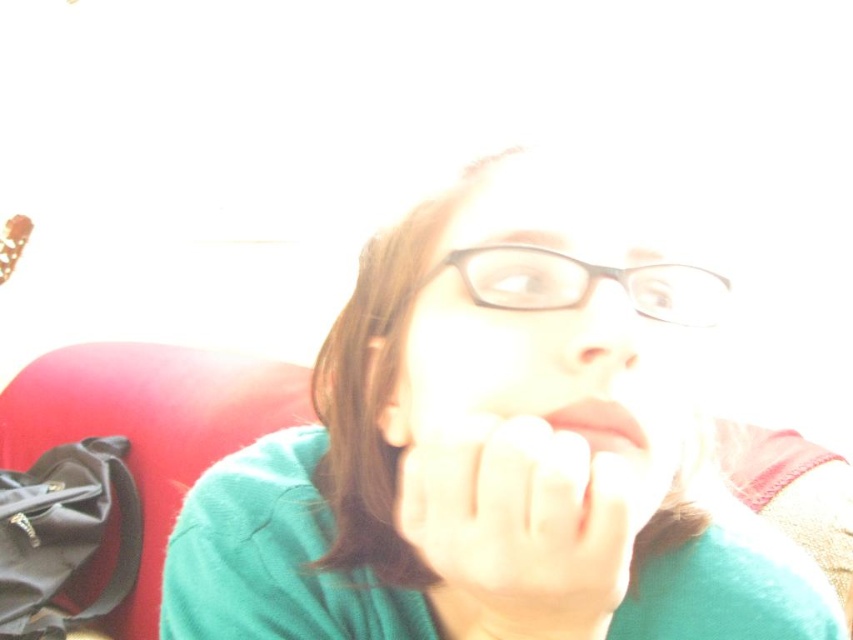
You are a photographer adjusting lighting for a portrait. You notice the transparent plastic glasses at center and the matte skin nose at center in the frame. Which object appears wider in the image?

The transparent plastic glasses at center appears wider than the matte skin nose at center because its width surpasses the nose.

Looking at this image, you are a photographer trying to capture the transparent plastic glasses at center in the image. The glasses are located at point 0.444 on the x axis and 0.686 on the y axis. If you want to adjust your camera to focus on the glasses, which direction should you move the focus point? Please answer with either left, right, up, or down.

The transparent plastic glasses at center are located at coordinates x 0.444 and y 0.686. Since the center of the image is typically at x 0.5 and y 0.5, moving the focus point slightly to the left and down would position it correctly over the glasses.